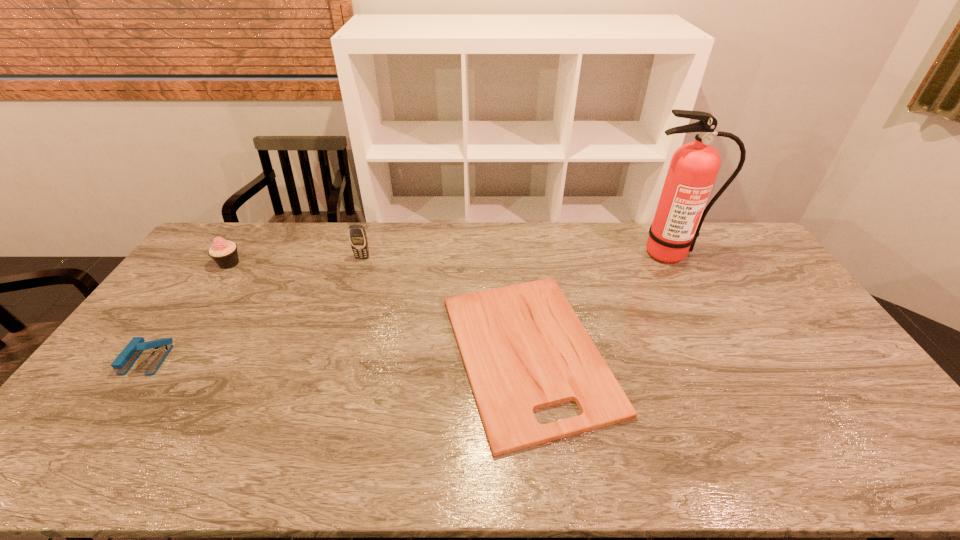
Locate an element on the screen. fire extinguisher is located at coordinates pos(694,166).

Locate an element on the screen. The height and width of the screenshot is (540, 960). the rightmost object is located at coordinates (694, 166).

This screenshot has width=960, height=540. Find the location of `the second tallest object`. the second tallest object is located at coordinates (357, 235).

You are a GUI agent. You are given a task and a screenshot of the screen. Output one action in this format:
    pyautogui.click(x=<x>, y=<y>)
    Task: Click on the third object from right to left
    Image resolution: width=960 pixels, height=540 pixels.
    Given the screenshot: What is the action you would take?
    pyautogui.click(x=357, y=235)

The height and width of the screenshot is (540, 960). What are the coordinates of `the third tallest object` in the screenshot? It's located at (224, 253).

I want to click on stapler, so click(x=124, y=361).

What are the coordinates of `the second object from right to left` in the screenshot? It's located at (524, 348).

This screenshot has width=960, height=540. What are the coordinates of `chopping board` in the screenshot? It's located at (524, 348).

Find the location of a particular element. The width and height of the screenshot is (960, 540). vacant space located on the handle side of the tallest object is located at coordinates (684, 281).

At what (x,y) coordinates should I click in order to perform the action: click on free spot located 0.180m on the front face of the third object from right to left. Please return your answer as a coordinate pair (x, y). This screenshot has width=960, height=540. Looking at the image, I should click on (350, 294).